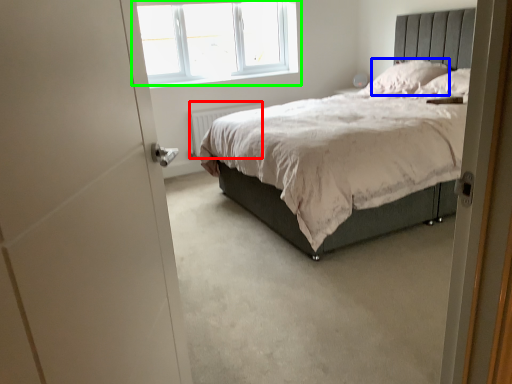
Question: Based on their relative distances, which object is farther from radiator (highlighted by a red box)? Choose from pillow (highlighted by a blue box) and window (highlighted by a green box).

Choices:
 (A) pillow
 (B) window

Answer: (A)